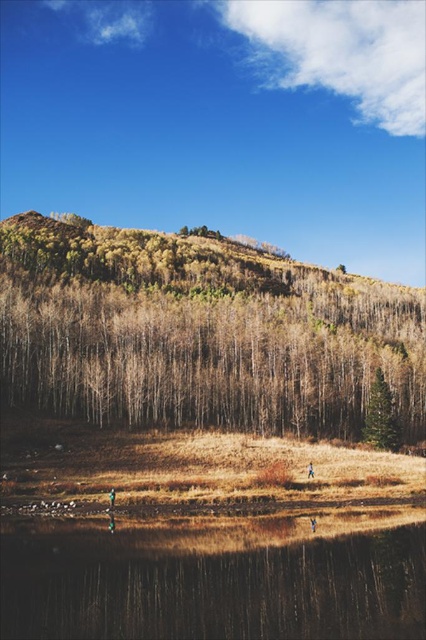
You are standing at the edge of the water in the scene and see the brown textured trees at upper center and the green fabric person at lower center. From your perspective, which object is positioned to the right?

The brown textured trees at upper center are to the right of the green fabric person at lower center.

You are standing in the forested hillside scene and want to walk from the point at coordinates point (x=317, y=387) to the point at coordinates point (x=112, y=500). Which direction should you head to get closer to your destination?

You should head downward because point (x=317, y=387) is further to the camera than point (x=112, y=500), meaning the destination is closer to the foreground and lower in the image.

You are an observer standing at the lakeside and want to take a photo of both the brown textured trees at upper center and the green matte tree at right. Which tree should you move closer to in order to capture both in the same frame?

You should move closer to the green matte tree at right because the brown textured trees at upper center is in front of it, so moving closer to the farther tree would help include both in the frame.